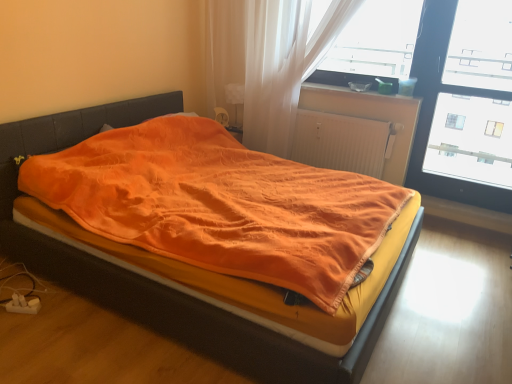
Question: Can you confirm if transparent plastic window screen at upper right, which ranks as the 2th window screen in right-to-left order, is taller than white ribbed radiator at center?

Choices:
 (A) yes
 (B) no

Answer: (A)

Question: Considering the relative positions of transparent plastic window screen at upper right, which ranks as the 2th window screen in right-to-left order, and white ribbed radiator at center in the image provided, is transparent plastic window screen at upper right, which ranks as the 2th window screen in right-to-left order, to the left of white ribbed radiator at center from the viewer's perspective?

Choices:
 (A) yes
 (B) no

Answer: (B)

Question: Does transparent plastic window screen at upper right, which is the 1th window screen in left-to-right order, touch white ribbed radiator at center?

Choices:
 (A) no
 (B) yes

Answer: (A)

Question: Is transparent plastic window screen at upper right, which ranks as the 2th window screen in right-to-left order, positioned before white ribbed radiator at center?

Choices:
 (A) no
 (B) yes

Answer: (B)

Question: Is transparent plastic window screen at upper right, which ranks as the 2th window screen in right-to-left order, oriented away from white ribbed radiator at center?

Choices:
 (A) yes
 (B) no

Answer: (B)

Question: Is transparent plastic window screen at upper right, which is the 1th window screen in left-to-right order, not within white ribbed radiator at center?

Choices:
 (A) no
 (B) yes

Answer: (B)

Question: Is transparent glass window at upper right, which is counted as the second window screen, starting from the left, positioned beyond the bounds of translucent fabric curtain at upper center?

Choices:
 (A) yes
 (B) no

Answer: (A)

Question: Is translucent fabric curtain at upper center located within transparent glass window at upper right, which is counted as the second window screen, starting from the left?

Choices:
 (A) yes
 (B) no

Answer: (B)

Question: Considering the relative sizes of transparent glass window at upper right, which is counted as the second window screen, starting from the left, and translucent fabric curtain at upper center in the image provided, is transparent glass window at upper right, which is counted as the second window screen, starting from the left, smaller than translucent fabric curtain at upper center?

Choices:
 (A) no
 (B) yes

Answer: (B)

Question: Is transparent glass window at upper right, the first window screen when ordered from right to left, further to camera compared to translucent fabric curtain at upper center?

Choices:
 (A) yes
 (B) no

Answer: (B)

Question: Considering the relative sizes of transparent glass window at upper right, which is counted as the second window screen, starting from the left, and translucent fabric curtain at upper center in the image provided, is transparent glass window at upper right, which is counted as the second window screen, starting from the left, bigger than translucent fabric curtain at upper center?

Choices:
 (A) no
 (B) yes

Answer: (A)

Question: Does transparent glass window at upper right, which is counted as the second window screen, starting from the left, have a greater height compared to translucent fabric curtain at upper center?

Choices:
 (A) no
 (B) yes

Answer: (B)

Question: Can transparent plastic window screen at upper right, which ranks as the 2th window screen in right-to-left order, be found inside matte plastic container at upper right?

Choices:
 (A) no
 (B) yes

Answer: (A)